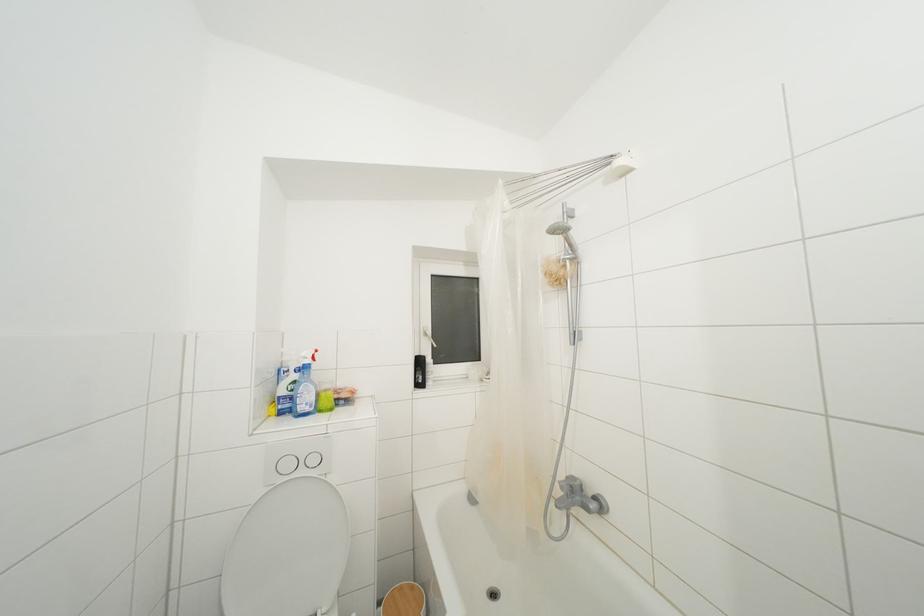
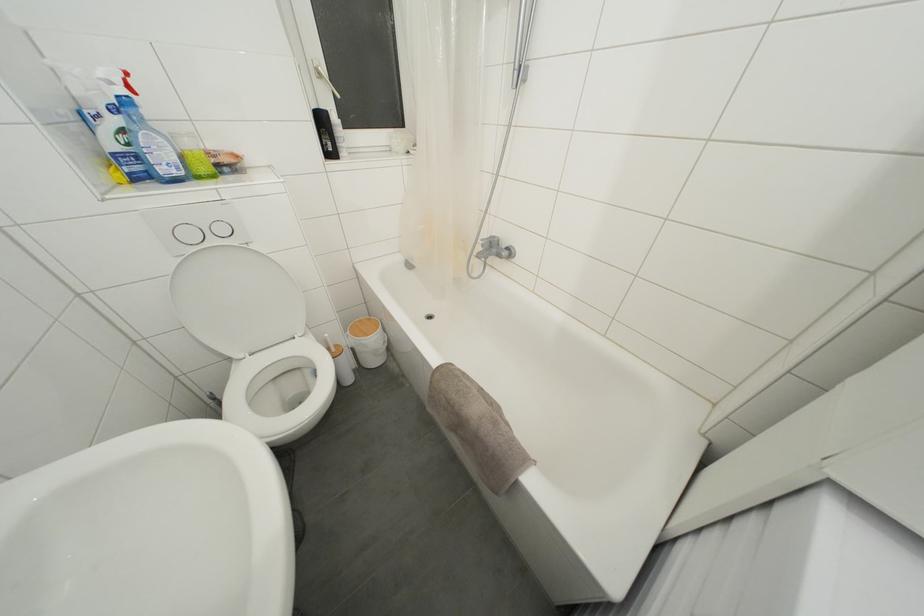
Where in the second image is the point corresponding to (x=423, y=367) from the first image?

(325, 126)